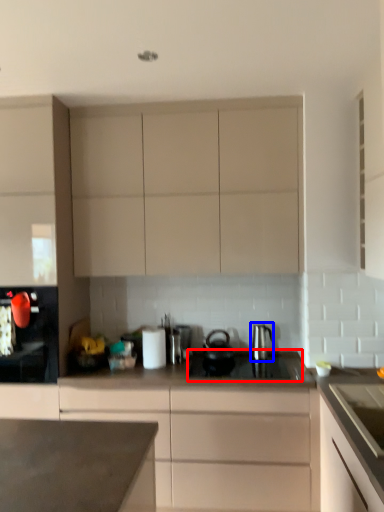
Question: Which of the following is the closest to the observer, gas stove (highlighted by a red box) or kitchen appliance (highlighted by a blue box)?

Choices:
 (A) gas stove
 (B) kitchen appliance

Answer: (A)